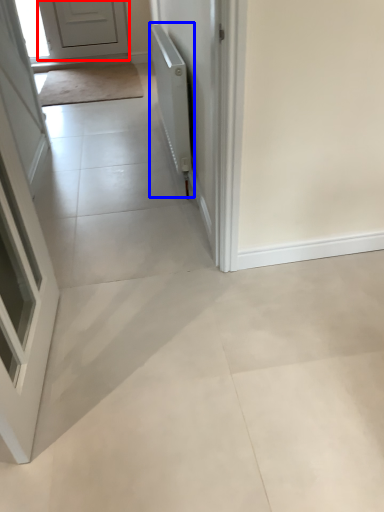
Question: Among these objects, which one is farthest to the camera, door (highlighted by a red box) or radiator (highlighted by a blue box)?

Choices:
 (A) door
 (B) radiator

Answer: (A)